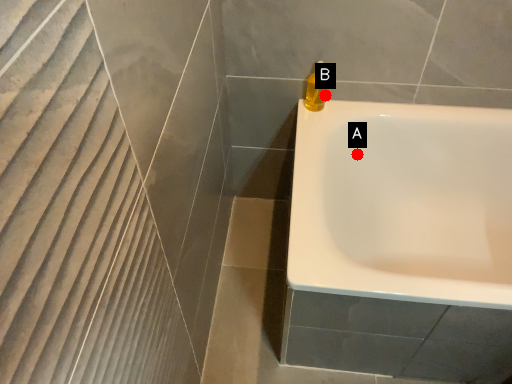
Question: Two points are circled on the image, labeled by A and B beside each circle. Which point is closer to the camera taking this photo?

Choices:
 (A) A is closer
 (B) B is closer

Answer: (B)